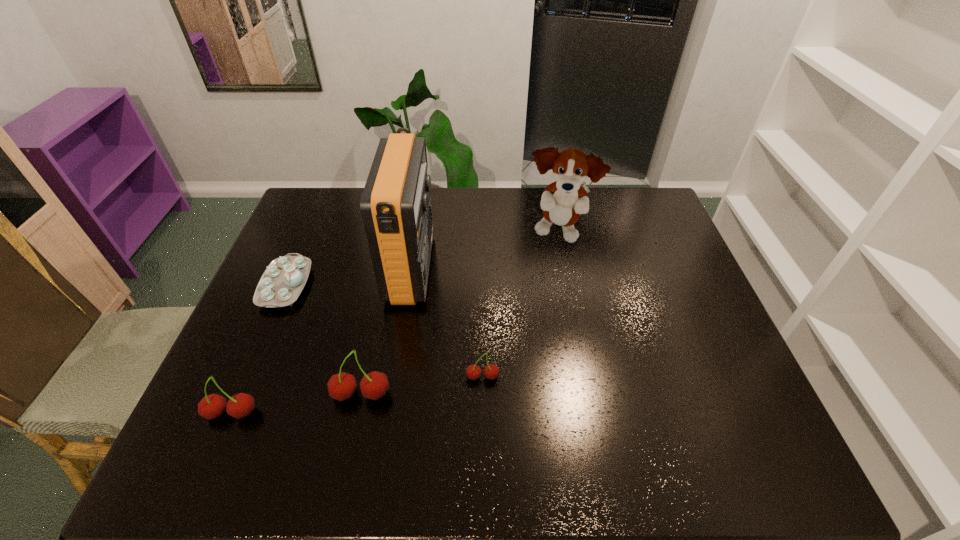
Locate an element on the screen. vacant space at the far left corner of the desktop is located at coordinates (326, 219).

Identify the location of free spot at the far right corner of the desktop. (633, 194).

Image resolution: width=960 pixels, height=540 pixels. I want to click on free space between the second cherry from right to left and the third shortest object, so click(297, 404).

The width and height of the screenshot is (960, 540). Find the location of `vacant space in between the shortest cherry and the chinaware`. vacant space in between the shortest cherry and the chinaware is located at coordinates (384, 331).

The width and height of the screenshot is (960, 540). What are the coordinates of `free spot between the radio receiver and the chinaware` in the screenshot? It's located at (348, 277).

This screenshot has height=540, width=960. Identify the location of empty space between the chinaware and the radio receiver. (348, 277).

Where is `vacant area between the radio receiver and the rightmost object`? vacant area between the radio receiver and the rightmost object is located at coordinates (485, 251).

Locate an element on the screen. This screenshot has height=540, width=960. free spot between the radio receiver and the leftmost cherry is located at coordinates tap(322, 341).

Find the location of `blank region between the rightmost object and the fifth object from left to right`. blank region between the rightmost object and the fifth object from left to right is located at coordinates (520, 305).

Identify the location of free spot between the shortest cherry and the second cherry from left to right. (422, 386).